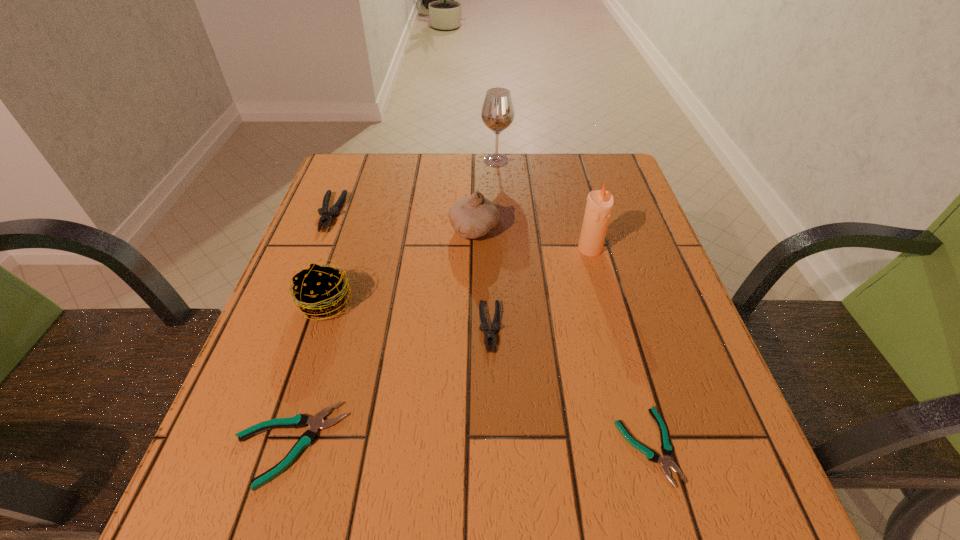
At what (x,y) coordinates should I click in order to perform the action: click on blank area at the left edge. Please return your answer as a coordinate pair (x, y). The width and height of the screenshot is (960, 540). Looking at the image, I should click on click(x=364, y=249).

You are a GUI agent. You are given a task and a screenshot of the screen. Output one action in this format:
    pyautogui.click(x=<x>, y=<y>)
    Task: Click on the vacant area at the right edge of the desktop
    
    Given the screenshot: What is the action you would take?
    pyautogui.click(x=642, y=359)

Identify the location of free space at the far left corner. The height and width of the screenshot is (540, 960). (339, 171).

Image resolution: width=960 pixels, height=540 pixels. I want to click on vacant region at the far right corner of the desktop, so click(592, 167).

The height and width of the screenshot is (540, 960). I want to click on vacant area that lies between the farthest object and the second farthest pliers, so click(x=493, y=244).

This screenshot has height=540, width=960. Find the location of `empty space between the patty and the farthest object`. empty space between the patty and the farthest object is located at coordinates (411, 231).

This screenshot has height=540, width=960. I want to click on free area in between the bigger gray pliers and the fifth shortest object, so click(x=328, y=258).

I want to click on free space between the fifth shortest object and the third tallest object, so click(399, 266).

The width and height of the screenshot is (960, 540). Identify the location of vacant area between the patty and the rightmost pliers. (486, 374).

The height and width of the screenshot is (540, 960). I want to click on vacant area that lies between the third pliers from left to right and the patty, so click(x=408, y=315).